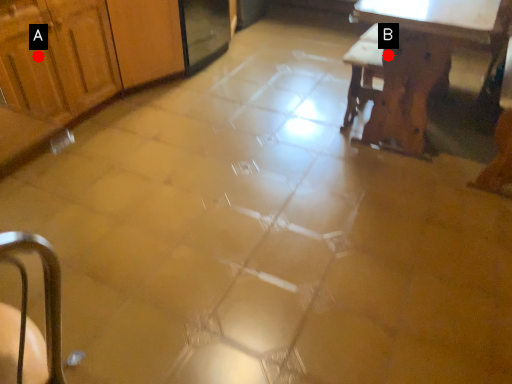
Question: Two points are circled on the image, labeled by A and B beside each circle. Which point appears farthest from the camera in this image?

Choices:
 (A) A is further
 (B) B is further

Answer: (A)